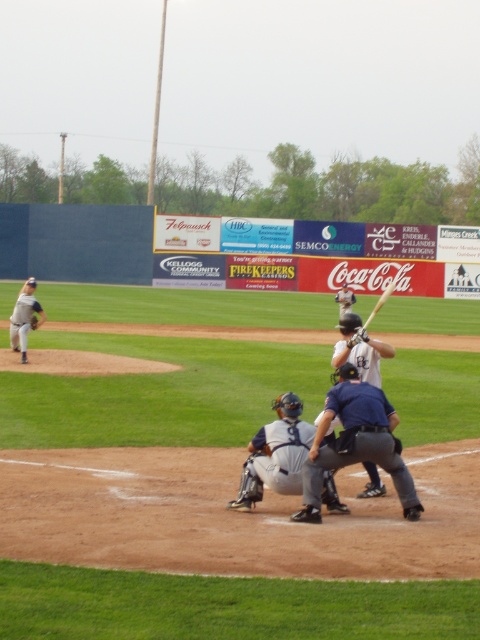
You are a spectator at the baseball game and want to take a photo of the dark blue uniform at center and the gray uniformed pitcher at left. In the photo, which player should be positioned to the left side to frame them correctly?

The gray uniformed pitcher at left should be positioned to the left side of the photo because the dark blue uniform at center is to the right of the gray uniformed pitcher at left.

You are a photographer trying to capture a closeup of the dark blue uniform at center and the wooden baseball bat at center. Which object should you zoom in on to fill the frame more effectively?

The wooden baseball bat at center is larger than the dark blue uniform at center, so zooming in on the wooden baseball bat at center would fill the frame more effectively.